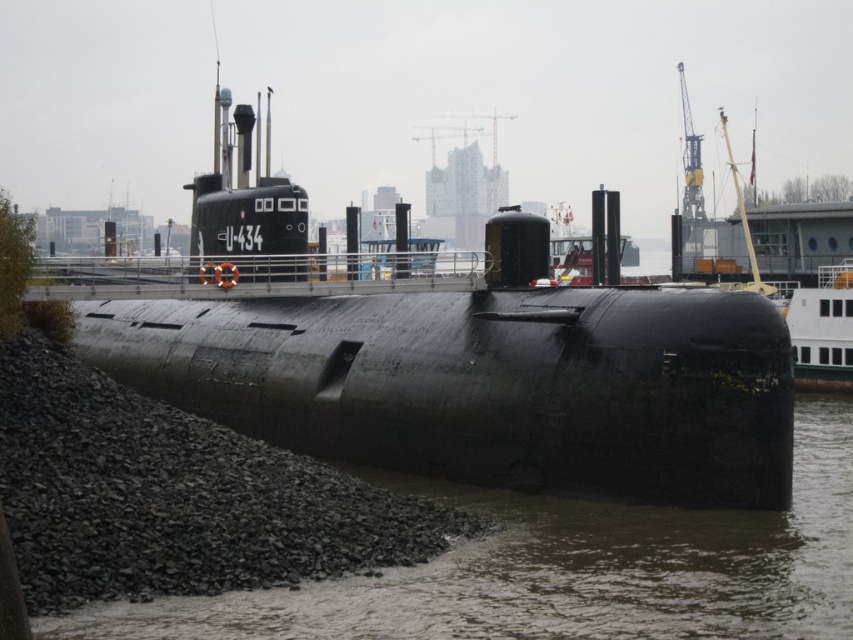
You are standing at the port and want to locate the matte black submarine at center. According to the coordinates provided, where should you look?

You should look at point (x=492, y=385) to find the matte black submarine at center.

You are standing on the dock and see the matte black submarine at center and the brown murky water at lower center. Which object is positioned to the right side?

The brown murky water at lower center is positioned to the right of the matte black submarine at center.